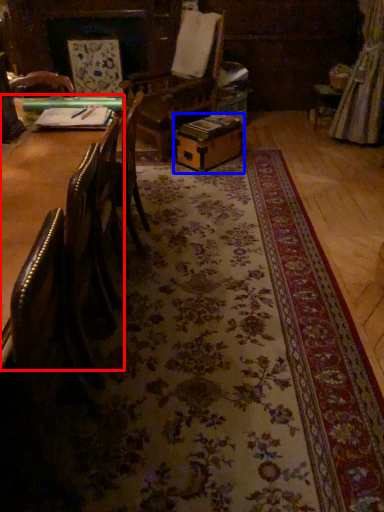
Question: Which object is closer to the camera taking this photo, table (highlighted by a red box) or cardboard box (highlighted by a blue box)?

Choices:
 (A) table
 (B) cardboard box

Answer: (A)